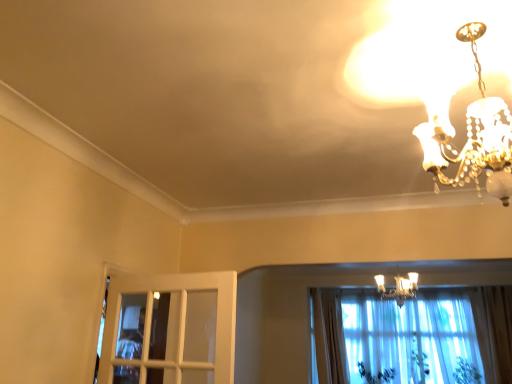
Locate an element on the screen. The width and height of the screenshot is (512, 384). gold metallic chandelier at upper right, marked as the 2th lamp in a top-to-bottom arrangement is located at coordinates (399, 287).

Image resolution: width=512 pixels, height=384 pixels. I want to click on gold metallic chandelier at upper right, the first lamp from the left, so click(x=472, y=137).

The width and height of the screenshot is (512, 384). Find the location of `gold metallic chandelier at upper right, the second lamp when ordered from left to right`. gold metallic chandelier at upper right, the second lamp when ordered from left to right is located at coordinates (399, 287).

Is light beige fabric curtain at lower center inside green leafy plant at lower right, placed as the third plant when sorted from right to left?

No, light beige fabric curtain at lower center is not surrounded by green leafy plant at lower right, placed as the third plant when sorted from right to left.

Identify the location of plant that is the 3rd object located behind the light beige fabric curtain at lower center. (376, 375).

How different are the orientations of green leafy plant at lower right, arranged as the first plant when viewed from the left, and light beige fabric curtain at lower center in degrees?

The angular difference between green leafy plant at lower right, arranged as the first plant when viewed from the left, and light beige fabric curtain at lower center is 0.29 degrees.

Is green leafy plant at lower right, placed as the third plant when sorted from right to left, in front of or behind light beige fabric curtain at lower center in the image?

Visually, green leafy plant at lower right, placed as the third plant when sorted from right to left, is located behind light beige fabric curtain at lower center.

Considering the relative positions of gold metallic chandelier at upper right, which ranks as the first lamp in top-to-bottom order, and green leafy plant at lower right, arranged as the first plant when viewed from the left, in the image provided, is gold metallic chandelier at upper right, which ranks as the first lamp in top-to-bottom order, to the left or to the right of green leafy plant at lower right, arranged as the first plant when viewed from the left,?

gold metallic chandelier at upper right, which ranks as the first lamp in top-to-bottom order, is to the left of green leafy plant at lower right, arranged as the first plant when viewed from the left.

From the image's perspective, which one is positioned higher, gold metallic chandelier at upper right, which is counted as the second lamp, starting from the right, or green leafy plant at lower right, arranged as the first plant when viewed from the left?

gold metallic chandelier at upper right, which is counted as the second lamp, starting from the right, from the image's perspective.

Is gold metallic chandelier at upper right, acting as the 2th lamp starting from the bottom, situated inside green leafy plant at lower right, placed as the third plant when sorted from right to left, or outside?

gold metallic chandelier at upper right, acting as the 2th lamp starting from the bottom, is not enclosed by green leafy plant at lower right, placed as the third plant when sorted from right to left.

Is gold metallic chandelier at upper right, which ranks as the first lamp in top-to-bottom order, positioned with its back to green leafy plant at lower right, placed as the third plant when sorted from right to left?

No.

Can green leafy plant at lower right, arranged as the 3th plant when viewed from the left, be found inside light beige fabric curtain at lower center?

No, green leafy plant at lower right, arranged as the 3th plant when viewed from the left, is not inside light beige fabric curtain at lower center.

Who is taller, light beige fabric curtain at lower center or green leafy plant at lower right, arranged as the 3th plant when viewed from the left?

light beige fabric curtain at lower center.

Considering the relative sizes of light beige fabric curtain at lower center and green leafy plant at lower right, the first plant viewed from the right, in the image provided, is light beige fabric curtain at lower center bigger than green leafy plant at lower right, the first plant viewed from the right,?

Indeed, light beige fabric curtain at lower center has a larger size compared to green leafy plant at lower right, the first plant viewed from the right.

Would you say green leafy plant at lower right, arranged as the first plant when viewed from the left, is outside green leafy plant at lower right, which ranks as the 2th plant in left-to-right order?

Indeed, green leafy plant at lower right, arranged as the first plant when viewed from the left, is completely outside green leafy plant at lower right, which ranks as the 2th plant in left-to-right order.

Does green leafy plant at lower right, arranged as the first plant when viewed from the left, have a smaller size compared to green leafy plant at lower right, acting as the 2th plant starting from the right?

Yes, green leafy plant at lower right, arranged as the first plant when viewed from the left, is smaller than green leafy plant at lower right, acting as the 2th plant starting from the right.

From a real-world perspective, is green leafy plant at lower right, placed as the third plant when sorted from right to left, below green leafy plant at lower right, which ranks as the 2th plant in left-to-right order?

Yes.

Based on their positions, is green leafy plant at lower right, arranged as the first plant when viewed from the left, located to the left or right of green leafy plant at lower right, which ranks as the 2th plant in left-to-right order?

From the image, it's evident that green leafy plant at lower right, arranged as the first plant when viewed from the left, is to the left of green leafy plant at lower right, which ranks as the 2th plant in left-to-right order.

From a real-world perspective, relative to light beige fabric curtain at lower center, is gold metallic chandelier at upper right, the first lamp from the left, vertically above or below?

From a real-world perspective, gold metallic chandelier at upper right, the first lamp from the left, is physically above light beige fabric curtain at lower center.

From the image's perspective, is gold metallic chandelier at upper right, the first lamp from the left, above light beige fabric curtain at lower center?

Yes.

Is gold metallic chandelier at upper right, the first lamp positioned from the front, looking in the opposite direction of light beige fabric curtain at lower center?

No, gold metallic chandelier at upper right, the first lamp positioned from the front, is not facing the opposite direction of light beige fabric curtain at lower center.

From the image's perspective, is green leafy plant at lower right, which ranks as the 2th plant in left-to-right order, located beneath gold metallic chandelier at upper right, marked as the 2th lamp in a top-to-bottom arrangement?

Correct, green leafy plant at lower right, which ranks as the 2th plant in left-to-right order, appears lower than gold metallic chandelier at upper right, marked as the 2th lamp in a top-to-bottom arrangement, in the image.

Where is `plant that is the 1st object directly below the gold metallic chandelier at upper right, marked as the 2th lamp in a top-to-bottom arrangement (from a real-world perspective)`? Image resolution: width=512 pixels, height=384 pixels. plant that is the 1st object directly below the gold metallic chandelier at upper right, marked as the 2th lamp in a top-to-bottom arrangement (from a real-world perspective) is located at coordinates (418, 360).

Are green leafy plant at lower right, acting as the 2th plant starting from the right, and gold metallic chandelier at upper right, the second lamp when ordered from left to right, far apart?

green leafy plant at lower right, acting as the 2th plant starting from the right, is far away from gold metallic chandelier at upper right, the second lamp when ordered from left to right.

Which is nearer, (x=416, y=353) or (x=400, y=280)?

Point (x=416, y=353) is farther from the camera than point (x=400, y=280).

In the scene shown: Relative to green leafy plant at lower right, which ranks as the 2th plant in left-to-right order, is light beige fabric curtain at lower center in front or behind?

light beige fabric curtain at lower center is positioned closer to the viewer than green leafy plant at lower right, which ranks as the 2th plant in left-to-right order.

From the picture: Is light beige fabric curtain at lower center bigger than green leafy plant at lower right, acting as the 2th plant starting from the right?

Correct, light beige fabric curtain at lower center is larger in size than green leafy plant at lower right, acting as the 2th plant starting from the right.

This screenshot has height=384, width=512. Identify the location of plant that is the 1st one below the light beige fabric curtain at lower center (from a real-world perspective). (418, 360).

Is light beige fabric curtain at lower center to the right of green leafy plant at lower right, which ranks as the 2th plant in left-to-right order, from the viewer's perspective?

In fact, light beige fabric curtain at lower center is to the left of green leafy plant at lower right, which ranks as the 2th plant in left-to-right order.

Which plant is the 1st one when counting from the right side of the light beige fabric curtain at lower center? Please provide its 2D coordinates.

[(376, 375)]

From the image's perspective, starting from the gold metallic chandelier at upper right, which is the second lamp from back to front, which plant is the 3rd one below? Please provide its 2D coordinates.

[(376, 375)]

Based on their spatial positions, is gold metallic chandelier at upper right, which ranks as the first lamp in top-to-bottom order, or green leafy plant at lower right, arranged as the 3th plant when viewed from the left, further from gold metallic chandelier at upper right, marked as the 2th lamp in a top-to-bottom arrangement?

gold metallic chandelier at upper right, which ranks as the first lamp in top-to-bottom order, is positioned further to the anchor gold metallic chandelier at upper right, marked as the 2th lamp in a top-to-bottom arrangement.

Looking at the image, which one is located further to gold metallic chandelier at upper right, the first lamp positioned from the front, gold metallic chandelier at upper right, the 1th lamp viewed from the back, or light beige fabric curtain at lower center?

Among the two, light beige fabric curtain at lower center is located further to gold metallic chandelier at upper right, the first lamp positioned from the front.

Based on their spatial positions, is green leafy plant at lower right, acting as the 2th plant starting from the right, or light beige fabric curtain at lower center further from gold metallic chandelier at upper right, the 1th lamp viewed from the back?

green leafy plant at lower right, acting as the 2th plant starting from the right, is positioned further to the anchor gold metallic chandelier at upper right, the 1th lamp viewed from the back.

Based on their spatial positions, is gold metallic chandelier at upper right, the 1th lamp viewed from the back, or light beige fabric curtain at lower center closer to green leafy plant at lower right, acting as the 2th plant starting from the right?

Based on the image, light beige fabric curtain at lower center appears to be nearer to green leafy plant at lower right, acting as the 2th plant starting from the right.

When comparing their distances from light beige fabric curtain at lower center, does green leafy plant at lower right, arranged as the 3th plant when viewed from the left, or gold metallic chandelier at upper right, marked as the 2th lamp in a top-to-bottom arrangement, seem closer?

gold metallic chandelier at upper right, marked as the 2th lamp in a top-to-bottom arrangement.

Which object lies nearer to the anchor point green leafy plant at lower right, arranged as the first plant when viewed from the left, green leafy plant at lower right, which ranks as the 2th plant in left-to-right order, or light beige fabric curtain at lower center?

green leafy plant at lower right, which ranks as the 2th plant in left-to-right order, is positioned closer to the anchor green leafy plant at lower right, arranged as the first plant when viewed from the left.

From the image, which object appears to be nearer to light beige fabric curtain at lower center, green leafy plant at lower right, arranged as the 3th plant when viewed from the left, or green leafy plant at lower right, placed as the third plant when sorted from right to left?

green leafy plant at lower right, placed as the third plant when sorted from right to left, lies closer to light beige fabric curtain at lower center than the other object.

From the image, which object appears to be farther from gold metallic chandelier at upper right, the first lamp from the left, light beige fabric curtain at lower center or green leafy plant at lower right, the first plant viewed from the right?

green leafy plant at lower right, the first plant viewed from the right, is further to gold metallic chandelier at upper right, the first lamp from the left.

You are a GUI agent. You are given a task and a screenshot of the screen. Output one action in this format:
    pyautogui.click(x=<x>, y=<y>)
    Task: Click on the curtain between gold metallic chandelier at upper right, marked as the 2th lamp in a top-to-bottom arrangement, and green leafy plant at lower right, acting as the 2th plant starting from the right, in the front-back direction
    
    Given the screenshot: What is the action you would take?
    pyautogui.click(x=329, y=336)

What are the coordinates of `curtain positioned between gold metallic chandelier at upper right, which is counted as the second lamp, starting from the right, and green leafy plant at lower right, the first plant viewed from the right, from near to far` in the screenshot? It's located at coord(329,336).

Identify the location of curtain located between gold metallic chandelier at upper right, which ranks as the first lamp in top-to-bottom order, and green leafy plant at lower right, arranged as the first plant when viewed from the left, in the depth direction. The image size is (512, 384). (329, 336).

In order to click on plant located between green leafy plant at lower right, arranged as the first plant when viewed from the left, and green leafy plant at lower right, arranged as the 3th plant when viewed from the left, in the left-right direction in this screenshot , I will do `click(418, 360)`.